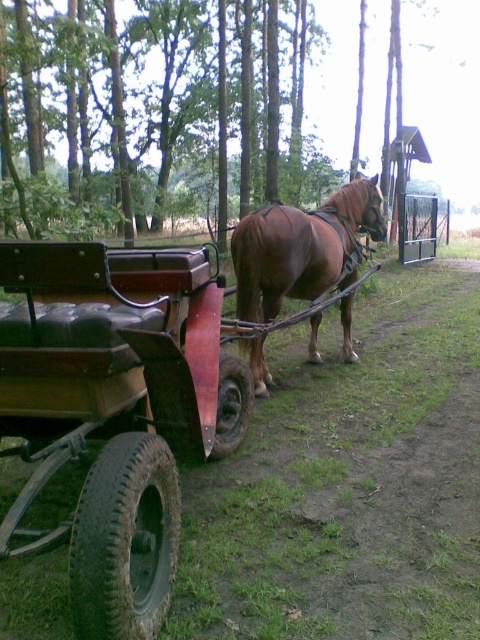
Describe the element at coordinates (116, 410) in the screenshot. This screenshot has width=480, height=640. I see `wooden/leather wagon at center-left` at that location.

Between wooden/leather wagon at center-left and brown glossy horse at center, which one has more height?

Standing taller between the two is brown glossy horse at center.

Who is more distant from viewer, (x=203, y=301) or (x=251, y=288)?

The point (x=251, y=288) is more distant.

Locate an element on the screen. The height and width of the screenshot is (640, 480). wooden/leather wagon at center-left is located at coordinates (116, 410).